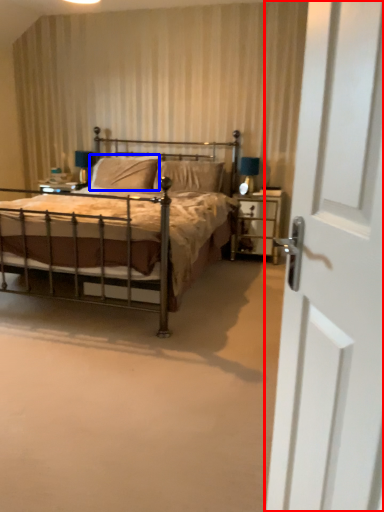
Question: Which point is further to the camera, door (highlighted by a red box) or pillow (highlighted by a blue box)?

Choices:
 (A) door
 (B) pillow

Answer: (B)